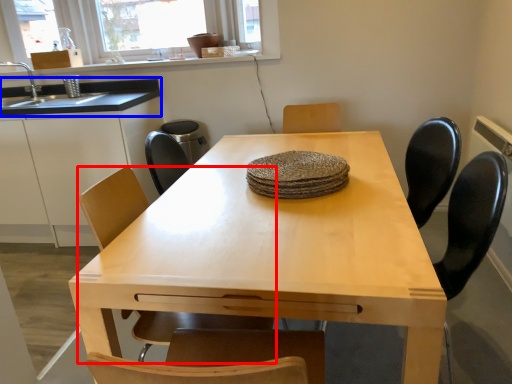
Question: Which of the following is the closest to the observer, chair (highlighted by a red box) or countertop (highlighted by a blue box)?

Choices:
 (A) chair
 (B) countertop

Answer: (A)